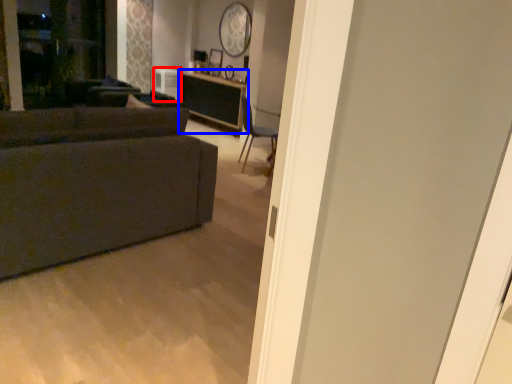
Question: Which point is closer to the camera, appliance (highlighted by a red box) or table (highlighted by a blue box)?

Choices:
 (A) appliance
 (B) table

Answer: (B)